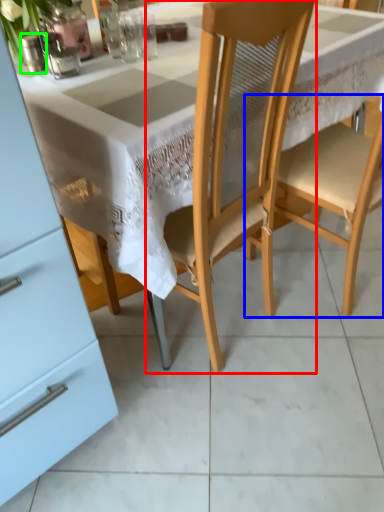
Question: Which object is the closest to the chair (highlighted by a red box)? Choose among these: chair (highlighted by a blue box) or tableware (highlighted by a green box).

Choices:
 (A) chair
 (B) tableware

Answer: (A)